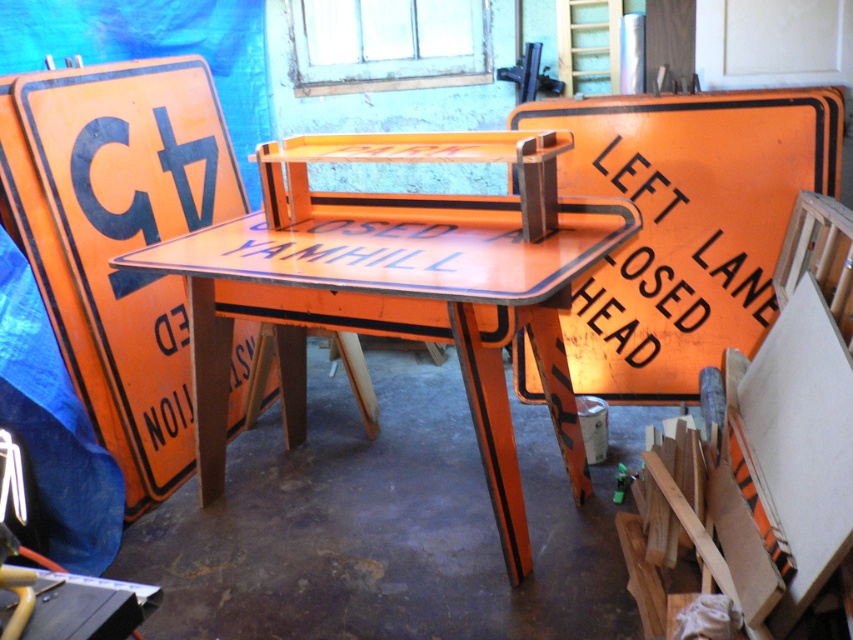
Does orange painted wood sign at left have a smaller size compared to orange painted metal sign at center?

No.

Between point (35, 120) and point (709, 204), which one is positioned in front?

Point (35, 120) is in front.

Does point (181, 81) lie behind point (665, 314)?

Yes, it is.

Locate an element on the screen. orange painted wood sign at left is located at coordinates (119, 237).

Does point (515, 552) lie behind point (665, 291)?

No, it is in front of (665, 291).

Is orange painted wood table at center positioned behind orange painted signboard at right?

No.

Measure the distance between point (x=222, y=378) and camera.

Point (x=222, y=378) is 2.81 meters away from camera.

Image resolution: width=853 pixels, height=640 pixels. I want to click on orange painted wood table at center, so click(x=395, y=308).

Is the position of orange painted wood sign at left more distant than that of green plastic hammer at lower right?

No, it is in front of green plastic hammer at lower right.

Locate an element on the screen. orange painted wood sign at left is located at coordinates (119, 237).